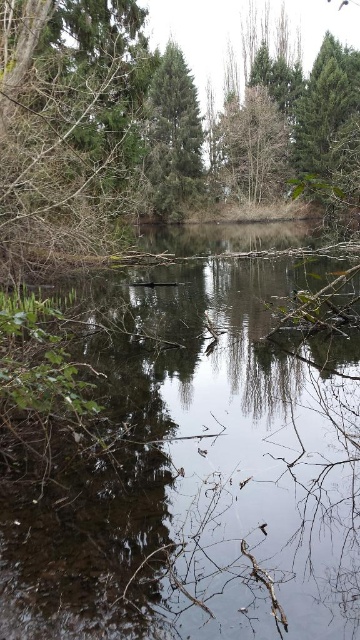
Question: Does green matte tree at upper left have a smaller size compared to green matte tree at center?

Choices:
 (A) no
 (B) yes

Answer: (B)

Question: Can you confirm if transparent water at center is positioned to the left of green matte tree at center?

Choices:
 (A) yes
 (B) no

Answer: (B)

Question: Can you confirm if green matte tree at upper left is positioned above green matte tree at center?

Choices:
 (A) no
 (B) yes

Answer: (A)

Question: Which point is farther to the camera?

Choices:
 (A) pyautogui.click(x=9, y=256)
 (B) pyautogui.click(x=185, y=163)
 (C) pyautogui.click(x=324, y=525)

Answer: (B)

Question: Estimate the real-world distances between objects in this image. Which object is farther from the green matte tree at upper left?

Choices:
 (A) transparent water at center
 (B) green matte tree at center

Answer: (B)

Question: Estimate the real-world distances between objects in this image. Which object is farther from the green matte tree at upper left?

Choices:
 (A) transparent water at center
 (B) green matte tree at center

Answer: (B)